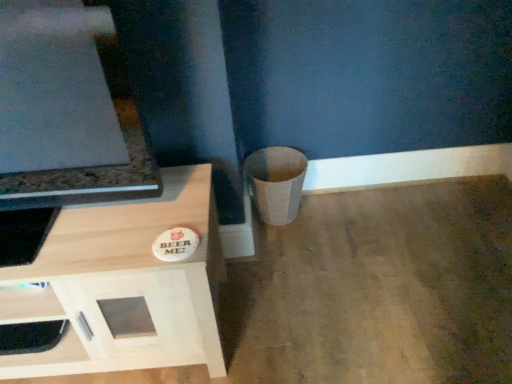
Question: Is matte beige trash can at lower right taller than white matte drawer at lower left?

Choices:
 (A) no
 (B) yes

Answer: (B)

Question: Would you say matte beige trash can at lower right contains white matte drawer at lower left?

Choices:
 (A) no
 (B) yes

Answer: (A)

Question: Is matte beige trash can at lower right turned away from white matte drawer at lower left?

Choices:
 (A) yes
 (B) no

Answer: (B)

Question: Does matte beige trash can at lower right have a lesser height compared to white matte drawer at lower left?

Choices:
 (A) no
 (B) yes

Answer: (A)

Question: Is matte beige trash can at lower right aimed at white matte drawer at lower left?

Choices:
 (A) yes
 (B) no

Answer: (B)

Question: From a real-world perspective, is matte beige trash can at lower right located higher than white matte drawer at lower left?

Choices:
 (A) no
 (B) yes

Answer: (A)

Question: Does white matte drawer at lower left have a lesser width compared to matte beige trash can at lower right?

Choices:
 (A) yes
 (B) no

Answer: (A)

Question: From the image's perspective, does white matte drawer at lower left appear lower than matte beige trash can at lower right?

Choices:
 (A) yes
 (B) no

Answer: (A)

Question: Is white matte drawer at lower left further to the viewer compared to matte beige trash can at lower right?

Choices:
 (A) yes
 (B) no

Answer: (B)

Question: Is white matte drawer at lower left facing towards matte beige trash can at lower right?

Choices:
 (A) yes
 (B) no

Answer: (B)

Question: Does white matte drawer at lower left appear on the left side of matte beige trash can at lower right?

Choices:
 (A) yes
 (B) no

Answer: (A)

Question: Is white matte drawer at lower left in front of matte beige trash can at lower right?

Choices:
 (A) no
 (B) yes

Answer: (B)

Question: Considering the relative positions of matte beige trash can at lower right and light wood cabinet at lower left in the image provided, is matte beige trash can at lower right in front of light wood cabinet at lower left?

Choices:
 (A) no
 (B) yes

Answer: (A)